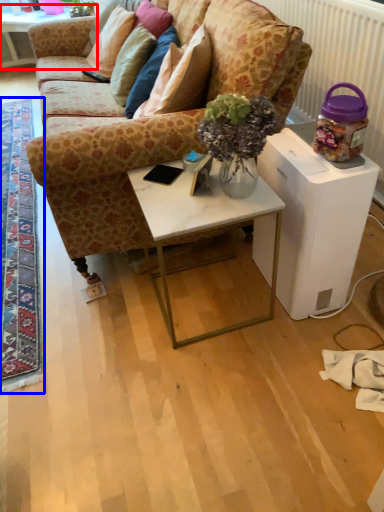
Question: Which object is further to the camera taking this photo, table (highlighted by a red box) or mat (highlighted by a blue box)?

Choices:
 (A) table
 (B) mat

Answer: (A)